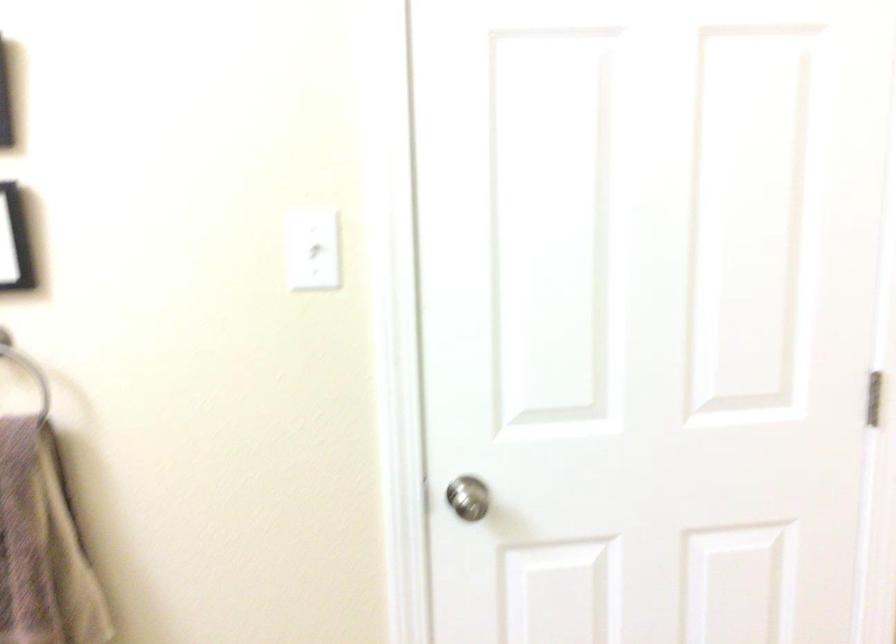
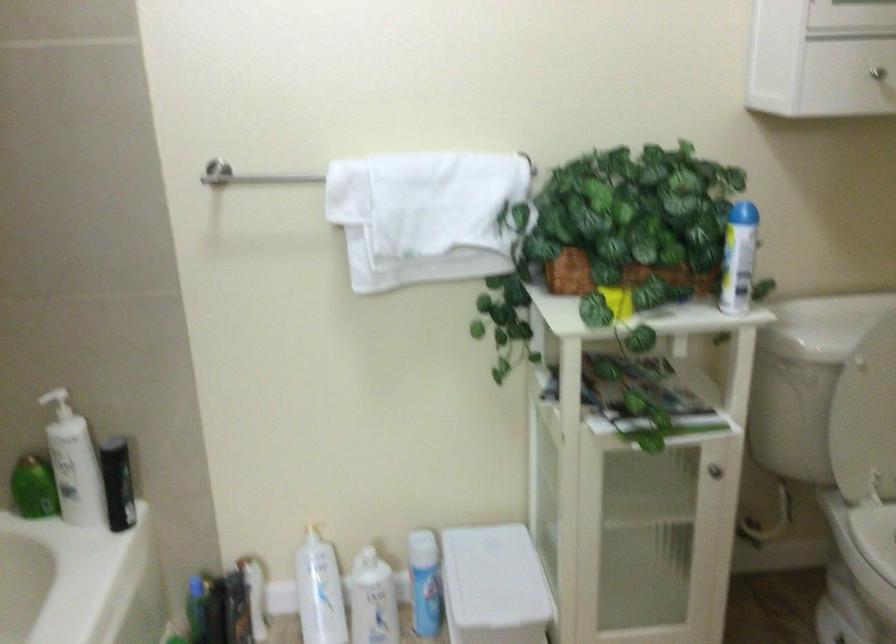
Question: The camera is either moving clockwise (left) or counter-clockwise (right) around the object. The first image is from the beginning of the video and the second image is from the end. Is the camera moving left or right when shooting the video?

Choices:
 (A) Left
 (B) Right

Answer: (A)